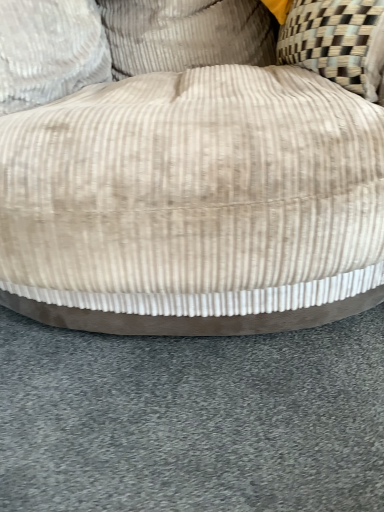
Question: Is beige corduroy ottoman at center bigger or smaller than beige corduroy pillow at upper center, positioned as the 1th pillow in right-to-left order?

Choices:
 (A) big
 (B) small

Answer: (A)

Question: Does point (233, 265) appear closer or farther from the camera than point (117, 41)?

Choices:
 (A) farther
 (B) closer

Answer: (B)

Question: Which object is the closest to the beige corduroy pillow at upper left, the 2th pillow from the right?

Choices:
 (A) beige corduroy ottoman at center
 (B) beige corduroy pillow at upper center, positioned as the 1th pillow in right-to-left order

Answer: (B)

Question: Which object is positioned farthest from the beige corduroy ottoman at center?

Choices:
 (A) beige corduroy pillow at upper center, the 2th pillow from the left
 (B) beige corduroy pillow at upper left, marked as the 1th pillow in a left-to-right arrangement

Answer: (A)